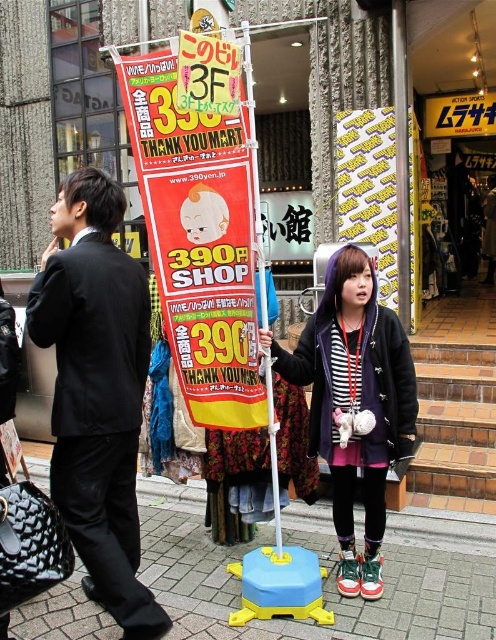
You are a pedestrian walking down the street and see the yellow paper sign at center and the yellow plastic sign at center. Which one is placed higher up?

The yellow paper sign at center is positioned over the yellow plastic sign at center, so it is placed higher up.

Consider the image. Based on the scene description, which sign is wider? The yellow paper sign at center or the yellow plastic sign at center?

The yellow paper sign at center is wider than the yellow plastic sign at center according to the description.

You are a pedestrian walking down the street and see both the yellow paper sign at center and the yellow plastic sign at center. Which one is taller?

The yellow paper sign at center is much taller than the yellow plastic sign at center.